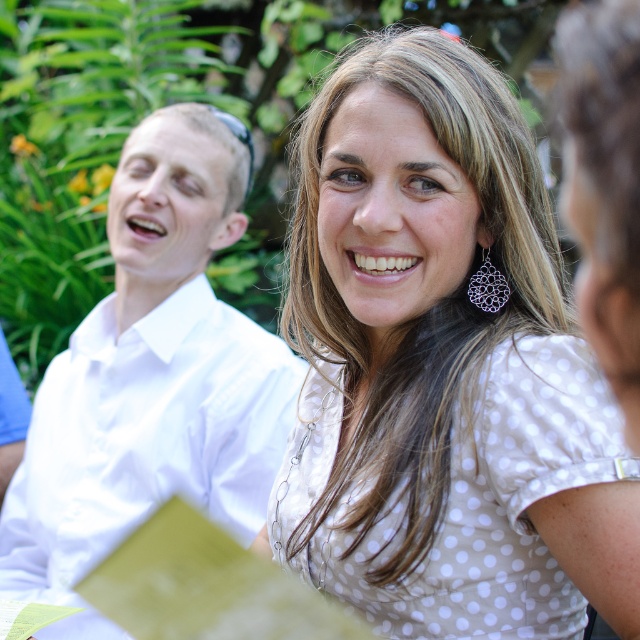
You are a photographer standing 10 feet away from the scene. You want to take a closeup shot of the white dotted shirt at center and the black textured earring at upper right. Can you fit both in the frame of a camera with a 100mm lens?

The white dotted shirt at center and black textured earring at upper right are 9.11 inches apart. At 10 feet distance with a 100mm lens, the field of view is approximately 12 inches wide. Since the distance between the two objects is within this range, both can be captured in the frame.

You are a photographer trying to capture a closeup of the white dotted shirt at center and the black textured earring at upper right. Which object should you focus on first to ensure both are in focus?

The white dotted shirt at center is closer to the viewer than the black textured earring at upper right, so you should focus on the white dotted shirt at center first to ensure both are in focus.

Looking at this image, you are standing in the scene and want to move from the point at coordinates point (195,276) to the point at coordinates point (481,268). Which direction should you move in to get closer to the latter?

To move from point (195,276) to point (481,268), you should move upward and slightly to the left because point (481,268) is located above and to the left of point (195,276).